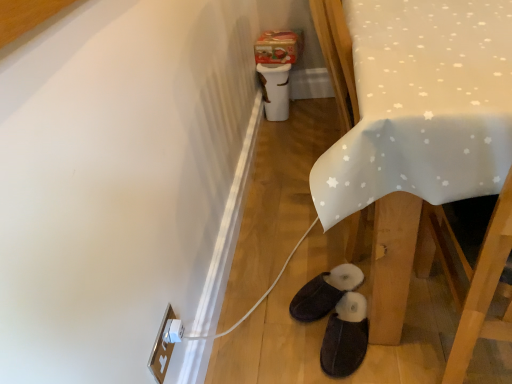
Where is `dark brown suede slippers at lower center, the 1th footwear in the front-to-back sequence`? dark brown suede slippers at lower center, the 1th footwear in the front-to-back sequence is located at coordinates (345, 336).

Measure the distance between point (318, 174) and camera.

Point (318, 174) and camera are 31.30 inches apart from each other.

The width and height of the screenshot is (512, 384). In order to click on dark brown suede slippers at lower center, the 1th footwear in the front-to-back sequence in this screenshot , I will do `click(345, 336)`.

Considering the positions of objects white plastic electric outlet at lower left and white fabric table at lower right in the image provided, who is in front, white plastic electric outlet at lower left or white fabric table at lower right?

Positioned in front is white fabric table at lower right.

Between white plastic electric outlet at lower left and white fabric table at lower right, which one appears on the right side from the viewer's perspective?

white fabric table at lower right.

Is white plastic electric outlet at lower left facing towards white fabric table at lower right?

No, white plastic electric outlet at lower left is not aimed at white fabric table at lower right.

From a real-world perspective, does black suede slippers at lower center, which is counted as the 1th footwear, starting from the back, stand above white plastic electric outlet at lower left?

No, from a real-world perspective, black suede slippers at lower center, which is counted as the 1th footwear, starting from the back, is not over white plastic electric outlet at lower left

Measure the distance between black suede slippers at lower center, which is counted as the 1th footwear, starting from the back, and white plastic electric outlet at lower left.

A distance of 21.31 inches exists between black suede slippers at lower center, which is counted as the 1th footwear, starting from the back, and white plastic electric outlet at lower left.

Which footwear is the 1st one when counting from the right side of the white plastic electric outlet at lower left? Please provide its 2D coordinates.

[(325, 292)]

Can you see black suede slippers at lower center, which is counted as the 1th footwear, starting from the back, touching white plastic electric outlet at lower left?

No, black suede slippers at lower center, which is counted as the 1th footwear, starting from the back, is not next to white plastic electric outlet at lower left.

Does black suede slippers at lower center, arranged as the second footwear when viewed from the front, contain dark brown suede slippers at lower center, the 1th footwear in the front-to-back sequence?

Actually, dark brown suede slippers at lower center, the 1th footwear in the front-to-back sequence, is outside black suede slippers at lower center, arranged as the second footwear when viewed from the front.

Is the position of black suede slippers at lower center, arranged as the second footwear when viewed from the front, less distant than that of dark brown suede slippers at lower center, the 1th footwear in the front-to-back sequence?

No, it is not.

Which object is positioned more to the right, black suede slippers at lower center, arranged as the second footwear when viewed from the front, or dark brown suede slippers at lower center, which ranks as the second footwear in back-to-front order?

dark brown suede slippers at lower center, which ranks as the second footwear in back-to-front order.

From a real-world perspective, is white plastic electric outlet at lower left over dark brown suede slippers at lower center, the 1th footwear in the front-to-back sequence?

Yes, from a real-world perspective, white plastic electric outlet at lower left is on top of dark brown suede slippers at lower center, the 1th footwear in the front-to-back sequence.

Does point (152, 359) come in front of point (335, 369)?

Yes, point (152, 359) is in front of point (335, 369).

Could you tell me if white plastic electric outlet at lower left is turned towards dark brown suede slippers at lower center, the 1th footwear in the front-to-back sequence?

No, white plastic electric outlet at lower left is not oriented towards dark brown suede slippers at lower center, the 1th footwear in the front-to-back sequence.

Is white plastic electric outlet at lower left at the left side of dark brown suede slippers at lower center, which ranks as the second footwear in back-to-front order?

Yes.

From the picture: Is there a large distance between white fabric table at lower right and dark brown suede slippers at lower center, the 1th footwear in the front-to-back sequence?

white fabric table at lower right is near dark brown suede slippers at lower center, the 1th footwear in the front-to-back sequence, not far away.

Would you say white fabric table at lower right is outside dark brown suede slippers at lower center, which ranks as the second footwear in back-to-front order?

Yes, white fabric table at lower right is located beyond the bounds of dark brown suede slippers at lower center, which ranks as the second footwear in back-to-front order.

Can you confirm if white fabric table at lower right is thinner than dark brown suede slippers at lower center, the 1th footwear in the front-to-back sequence?

No, white fabric table at lower right is not thinner than dark brown suede slippers at lower center, the 1th footwear in the front-to-back sequence.

Where is `the 1st footwear located beneath the white fabric table at lower right (from a real-world perspective)`? the 1st footwear located beneath the white fabric table at lower right (from a real-world perspective) is located at coordinates (345, 336).

Which object is thinner, dark brown suede slippers at lower center, the 1th footwear in the front-to-back sequence, or white plastic electric outlet at lower left?

Thinner between the two is white plastic electric outlet at lower left.

Based on their positions, is dark brown suede slippers at lower center, which ranks as the second footwear in back-to-front order, located to the left or right of white plastic electric outlet at lower left?

From the image, it's evident that dark brown suede slippers at lower center, which ranks as the second footwear in back-to-front order, is to the right of white plastic electric outlet at lower left.

Is white plastic electric outlet at lower left at the back of dark brown suede slippers at lower center, which ranks as the second footwear in back-to-front order?

That's not correct — dark brown suede slippers at lower center, which ranks as the second footwear in back-to-front order, is not looking away from white plastic electric outlet at lower left.

Considering the positions of point (362, 358) and point (167, 355), is point (362, 358) closer or farther from the camera than point (167, 355)?

Point (362, 358) appears to be farther away from the viewer than point (167, 355).

You are a GUI agent. You are given a task and a screenshot of the screen. Output one action in this format:
    pyautogui.click(x=<x>, y=<y>)
    Task: Click on the footwear that is the 2nd object to the left of the white fabric table at lower right, starting at the anchor
    
    Given the screenshot: What is the action you would take?
    pyautogui.click(x=325, y=292)

Between black suede slippers at lower center, arranged as the second footwear when viewed from the front, and white fabric table at lower right, which one has smaller width?

black suede slippers at lower center, arranged as the second footwear when viewed from the front, is thinner.

Looking at this image, is black suede slippers at lower center, which is counted as the 1th footwear, starting from the back, to the left of white fabric table at lower right from the viewer's perspective?

Correct, you'll find black suede slippers at lower center, which is counted as the 1th footwear, starting from the back, to the left of white fabric table at lower right.

Is black suede slippers at lower center, arranged as the second footwear when viewed from the front, next to white fabric table at lower right?

black suede slippers at lower center, arranged as the second footwear when viewed from the front, and white fabric table at lower right are clearly separated.

Identify the location of furniture that is on the right side of white plastic electric outlet at lower left. (412, 123).

Find the location of a particular element. The width and height of the screenshot is (512, 384). electric outlet in front of the black suede slippers at lower center, arranged as the second footwear when viewed from the front is located at coordinates (162, 348).

When comparing their distances from dark brown suede slippers at lower center, which ranks as the second footwear in back-to-front order, does black suede slippers at lower center, arranged as the second footwear when viewed from the front, or white fabric table at lower right seem closer?

black suede slippers at lower center, arranged as the second footwear when viewed from the front, is closer to dark brown suede slippers at lower center, which ranks as the second footwear in back-to-front order.

Which object lies further to the anchor point white fabric table at lower right, dark brown suede slippers at lower center, which ranks as the second footwear in back-to-front order, or black suede slippers at lower center, which is counted as the 1th footwear, starting from the back?

Based on the image, black suede slippers at lower center, which is counted as the 1th footwear, starting from the back, appears to be further to white fabric table at lower right.

From the picture: From the image, which object appears to be nearer to white plastic electric outlet at lower left, dark brown suede slippers at lower center, which ranks as the second footwear in back-to-front order, or black suede slippers at lower center, arranged as the second footwear when viewed from the front?

dark brown suede slippers at lower center, which ranks as the second footwear in back-to-front order, is closer to white plastic electric outlet at lower left.

When comparing their distances from white fabric table at lower right, does black suede slippers at lower center, which is counted as the 1th footwear, starting from the back, or dark brown suede slippers at lower center, the 1th footwear in the front-to-back sequence, seem closer?

dark brown suede slippers at lower center, the 1th footwear in the front-to-back sequence, is positioned closer to the anchor white fabric table at lower right.

From the picture: Which object lies nearer to the anchor point black suede slippers at lower center, arranged as the second footwear when viewed from the front, white plastic electric outlet at lower left or white fabric table at lower right?

The object closer to black suede slippers at lower center, arranged as the second footwear when viewed from the front, is white plastic electric outlet at lower left.

Estimate the real-world distances between objects in this image. Which object is closer to white plastic electric outlet at lower left, dark brown suede slippers at lower center, which ranks as the second footwear in back-to-front order, or white fabric table at lower right?

dark brown suede slippers at lower center, which ranks as the second footwear in back-to-front order, is closer to white plastic electric outlet at lower left.

Considering their positions, is dark brown suede slippers at lower center, the 1th footwear in the front-to-back sequence, positioned closer to white fabric table at lower right than white plastic electric outlet at lower left?

dark brown suede slippers at lower center, the 1th footwear in the front-to-back sequence, is positioned closer to the anchor white fabric table at lower right.

Estimate the real-world distances between objects in this image. Which object is further from black suede slippers at lower center, arranged as the second footwear when viewed from the front, dark brown suede slippers at lower center, the 1th footwear in the front-to-back sequence, or white plastic electric outlet at lower left?

The object further to black suede slippers at lower center, arranged as the second footwear when viewed from the front, is white plastic electric outlet at lower left.

You are a GUI agent. You are given a task and a screenshot of the screen. Output one action in this format:
    pyautogui.click(x=<x>, y=<y>)
    Task: Click on the footwear between white plastic electric outlet at lower left and dark brown suede slippers at lower center, the 1th footwear in the front-to-back sequence, in the horizontal direction
    
    Given the screenshot: What is the action you would take?
    pyautogui.click(x=325, y=292)

The image size is (512, 384). Find the location of `footwear between white fabric table at lower right and dark brown suede slippers at lower center, the 1th footwear in the front-to-back sequence, in the vertical direction`. footwear between white fabric table at lower right and dark brown suede slippers at lower center, the 1th footwear in the front-to-back sequence, in the vertical direction is located at coordinates (325, 292).